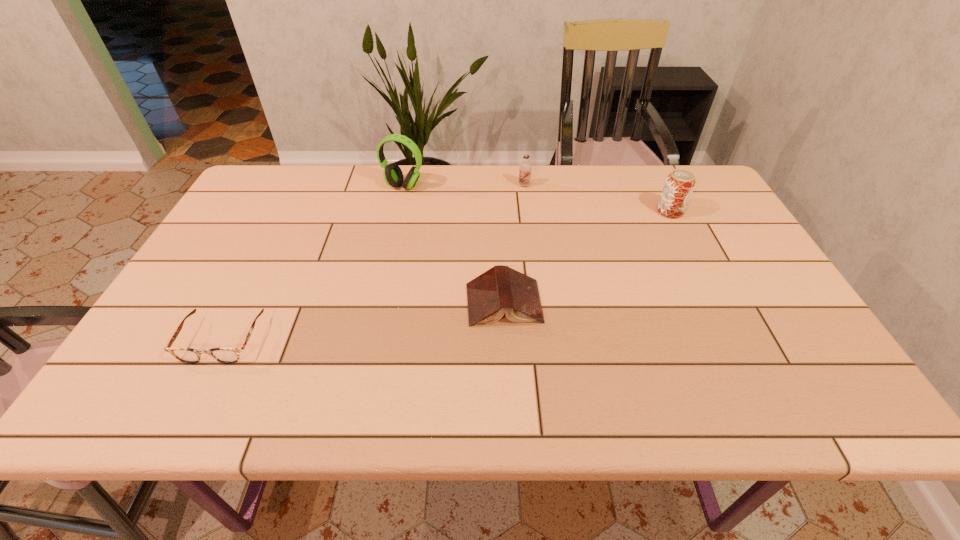
The height and width of the screenshot is (540, 960). Identify the location of free point at the near edge. (377, 382).

In the image, there is a desktop. Identify the location of free space at the left edge. (212, 252).

The image size is (960, 540). I want to click on free space at the right edge of the desktop, so click(x=762, y=288).

This screenshot has height=540, width=960. What are the coordinates of `vacant space at the far left corner of the desktop` in the screenshot? It's located at (280, 201).

This screenshot has height=540, width=960. Find the location of `free area in between the leftmost object and the book`. free area in between the leftmost object and the book is located at coordinates (363, 321).

Identify the location of free spot between the book and the spectacles. This screenshot has height=540, width=960. (363, 321).

Where is `vacant space that's between the shortest object and the tallest object`? vacant space that's between the shortest object and the tallest object is located at coordinates (313, 263).

Identify the location of vacant point located between the spectacles and the tallest object. The image size is (960, 540). (313, 263).

The width and height of the screenshot is (960, 540). I want to click on empty location between the third nearest object and the third tallest object, so click(x=597, y=198).

This screenshot has width=960, height=540. Find the location of `free space between the third shortest object and the beer can`. free space between the third shortest object and the beer can is located at coordinates (597, 198).